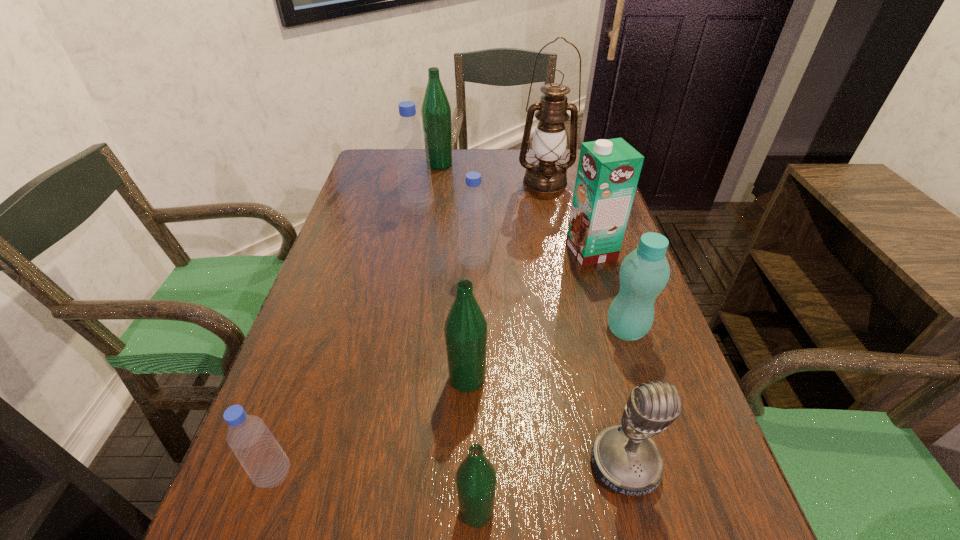
Identify the location of empty location between the seventh farthest object and the nearest green bottle. This screenshot has height=540, width=960. (472, 444).

Find the location of a particular element. Image resolution: width=960 pixels, height=540 pixels. vacant space that is in between the carton and the farthest bottle is located at coordinates (516, 207).

You are a GUI agent. You are given a task and a screenshot of the screen. Output one action in this format:
    pyautogui.click(x=<x>, y=<y>)
    Task: Click on the free space that is in between the smallest green bottle and the leftmost object
    
    Given the screenshot: What is the action you would take?
    pyautogui.click(x=375, y=492)

I want to click on vacant point located between the fifth nearest object and the second smallest green bottle, so tap(547, 354).

The width and height of the screenshot is (960, 540). I want to click on free spot between the third nearest bottle and the sixth farthest object, so click(547, 354).

This screenshot has width=960, height=540. Find the location of `object that is the ninth closest to the rightmost bottle`. object that is the ninth closest to the rightmost bottle is located at coordinates (436, 111).

The height and width of the screenshot is (540, 960). Find the location of `the seventh closest object to the biggest blue bottle`. the seventh closest object to the biggest blue bottle is located at coordinates (259, 453).

Find the location of a particular element. The width and height of the screenshot is (960, 540). bottle that is the closest to the leftmost green bottle is located at coordinates (415, 186).

Select which bottle appears as the second closest to the second biggest blue bottle. Please provide its 2D coordinates. Your answer should be formatted as a tuple, i.e. [(x, y)], where the tuple contains the x and y coordinates of a point satisfying the conditions above.

[(465, 329)]

This screenshot has height=540, width=960. I want to click on blue bottle that is the closest to the fourth nearest object, so click(x=473, y=204).